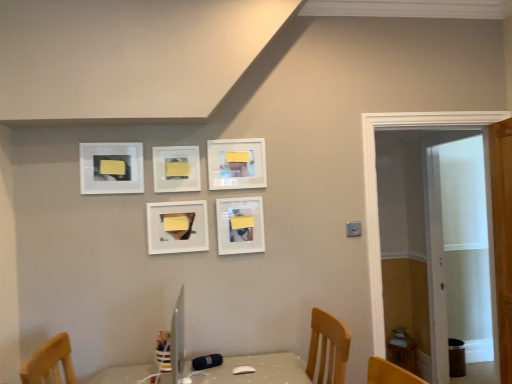
Question: Is matte white picture frame at center, placed as the 5th picture frame when sorted from left to right, inside or outside of matte white picture frame at center, arranged as the 3th picture frame when viewed from the left?

Choices:
 (A) outside
 (B) inside

Answer: (A)

Question: In the image, is matte white picture frame at center, placed as the 5th picture frame when sorted from left to right, positioned in front of or behind matte white picture frame at center, marked as the third picture frame in a right-to-left arrangement?

Choices:
 (A) front
 (B) behind

Answer: (B)

Question: Estimate the real-world distances between objects in this image. Which object is closer to the matte white picture frame at upper center, which is counted as the second picture frame, starting from the right?

Choices:
 (A) yellow matte picture frame at center, the 2th picture frame positioned from the left
 (B) matte white picture frame at center, which appears as the 1th picture frame when viewed from the right
 (C) matte white picture frame at center, arranged as the 3th picture frame when viewed from the left
 (D) matte white picture frame at upper left, the 1th picture frame positioned from the left
 (E) white wooden door at right

Answer: (A)

Question: Considering the real-world distances, which object is closest to the white wooden door at right?

Choices:
 (A) matte white picture frame at upper center, acting as the 4th picture frame starting from the left
 (B) yellow matte picture frame at center, the 2th picture frame positioned from the left
 (C) matte white picture frame at upper left, arranged as the fifth picture frame when viewed from the right
 (D) matte white picture frame at center, which appears as the 1th picture frame when viewed from the right
 (E) matte white picture frame at center, arranged as the 3th picture frame when viewed from the left

Answer: (A)